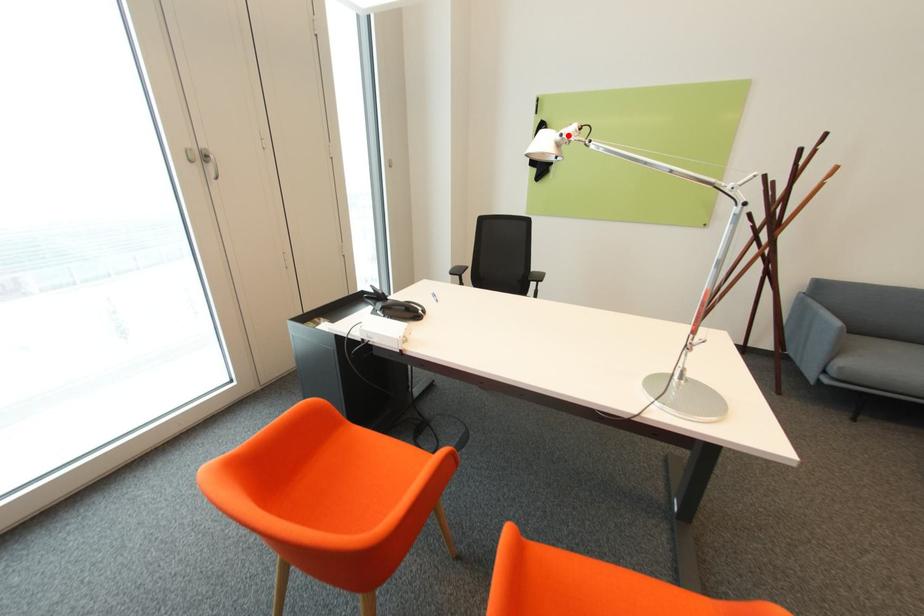
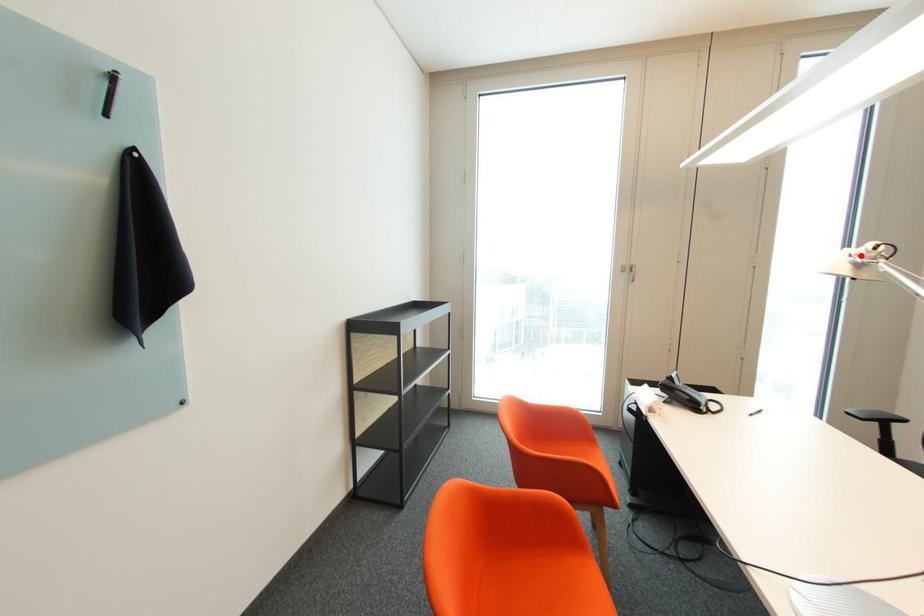
I am providing you with two images of the same scene from different viewpoints. A red point is marked on the first image and another point is marked on the second image. Is the marked point in image1 the same physical position as the marked point in image2?

Yes